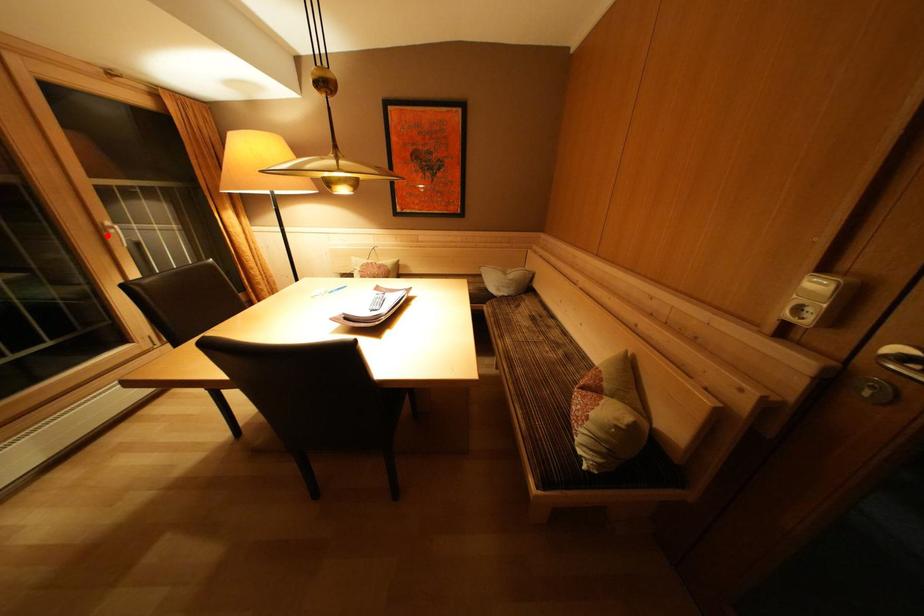
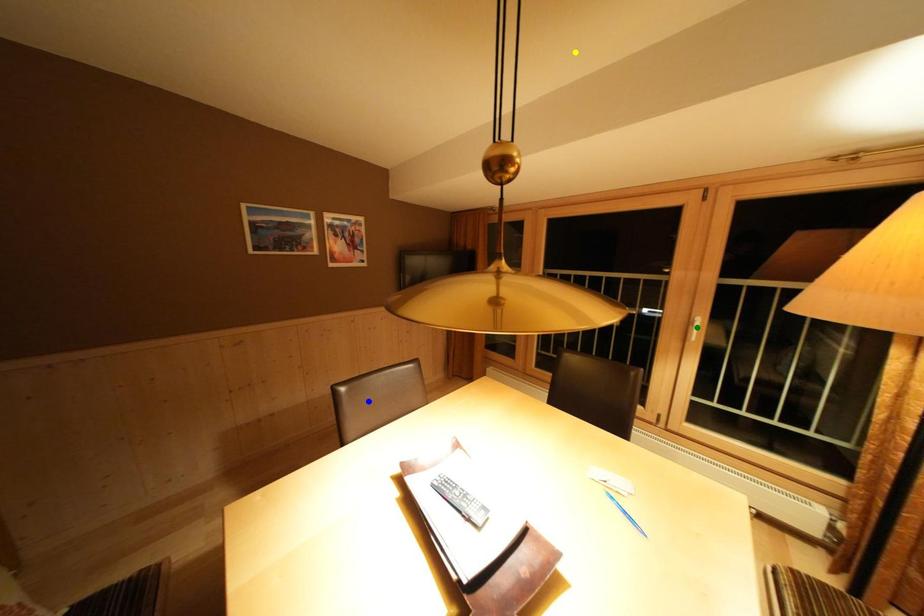
Question: I am providing you with two images of the same scene from different viewpoints. A red point is marked on the first image. You are given multiple points on the second image. Can you choose the point in image 2 that corresponds to the point in image 1?

Choices:
 (A) green point
 (B) blue point
 (C) yellow point

Answer: (A)